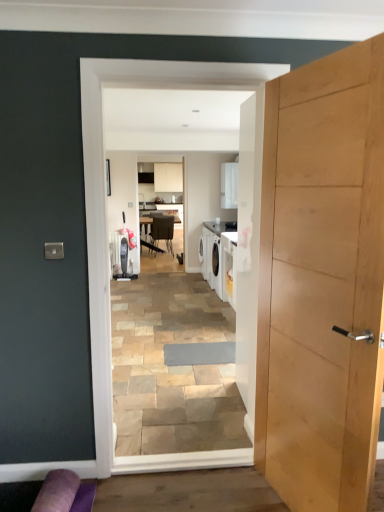
Question: Can we say white glossy laundry machine at center lies outside light wood door at right?

Choices:
 (A) yes
 (B) no

Answer: (A)

Question: Considering the relative sizes of white glossy laundry machine at center and light wood door at right in the image provided, is white glossy laundry machine at center shorter than light wood door at right?

Choices:
 (A) no
 (B) yes

Answer: (A)

Question: From the image's perspective, is white glossy laundry machine at center above light wood door at right?

Choices:
 (A) yes
 (B) no

Answer: (A)

Question: Is white glossy laundry machine at center taller than light wood door at right?

Choices:
 (A) yes
 (B) no

Answer: (A)

Question: Is white glossy laundry machine at center bigger than light wood door at right?

Choices:
 (A) no
 (B) yes

Answer: (A)

Question: From the image's perspective, is light wood door at right positioned above or below metallic silver chair at center?

Choices:
 (A) above
 (B) below

Answer: (B)

Question: Is point (278, 362) positioned closer to the camera than point (168, 219)?

Choices:
 (A) closer
 (B) farther

Answer: (A)

Question: Is light wood door at right wider or thinner than metallic silver chair at center?

Choices:
 (A) wide
 (B) thin

Answer: (B)

Question: Looking at the image, does light wood door at right seem bigger or smaller compared to metallic silver chair at center?

Choices:
 (A) big
 (B) small

Answer: (A)

Question: Would you say purple fabric couch at lower left is inside or outside metallic silver chair at center?

Choices:
 (A) inside
 (B) outside

Answer: (B)

Question: Is purple fabric couch at lower left bigger or smaller than metallic silver chair at center?

Choices:
 (A) big
 (B) small

Answer: (B)

Question: From the image's perspective, relative to metallic silver chair at center, is purple fabric couch at lower left above or below?

Choices:
 (A) above
 (B) below

Answer: (B)

Question: From a real-world perspective, is purple fabric couch at lower left above or below metallic silver chair at center?

Choices:
 (A) below
 (B) above

Answer: (A)

Question: In the image, is metallic silver chair at center positioned in front of or behind white glossy laundry machine at center?

Choices:
 (A) front
 (B) behind

Answer: (B)

Question: Based on their sizes in the image, would you say metallic silver chair at center is bigger or smaller than white glossy laundry machine at center?

Choices:
 (A) small
 (B) big

Answer: (B)